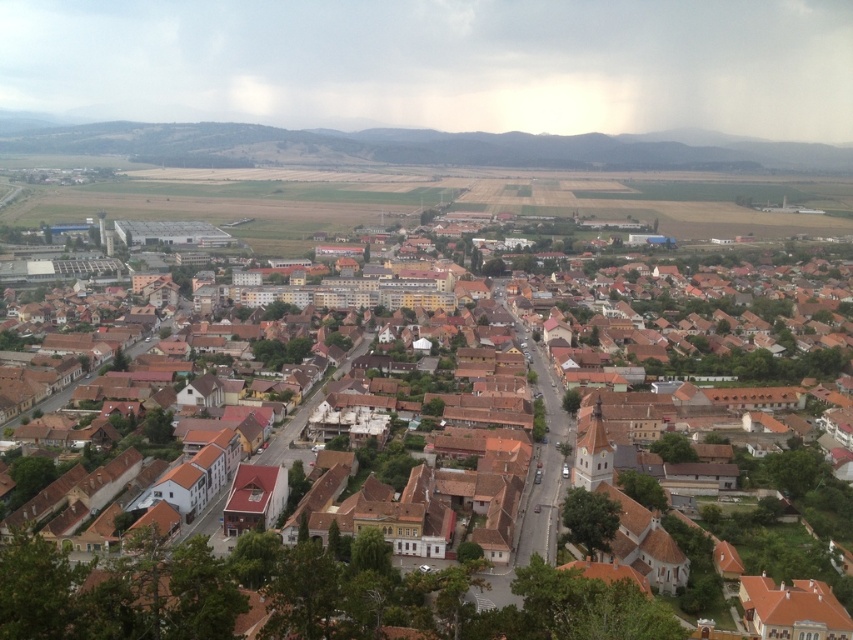
Question: Where is brown tiled roofs at center located in relation to green grassy hill at upper center in the image?

Choices:
 (A) right
 (B) left

Answer: (A)

Question: Does brown tiled roofs at center have a greater width compared to green grassy hill at upper center?

Choices:
 (A) yes
 (B) no

Answer: (B)

Question: Can you confirm if brown tiled roofs at center is wider than green grassy hill at upper center?

Choices:
 (A) no
 (B) yes

Answer: (A)